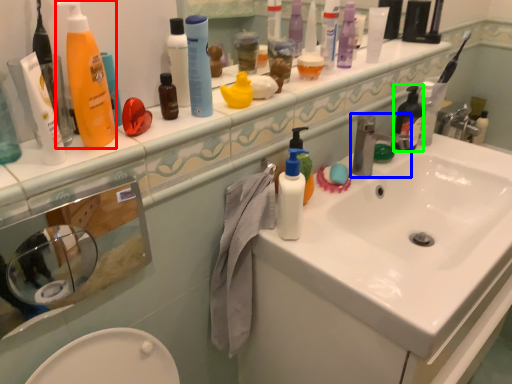
Question: Which object is the farthest from cleaning product (highlighted by a red box)? Choose among these: tap (highlighted by a blue box) or toiletry (highlighted by a green box).

Choices:
 (A) tap
 (B) toiletry

Answer: (B)